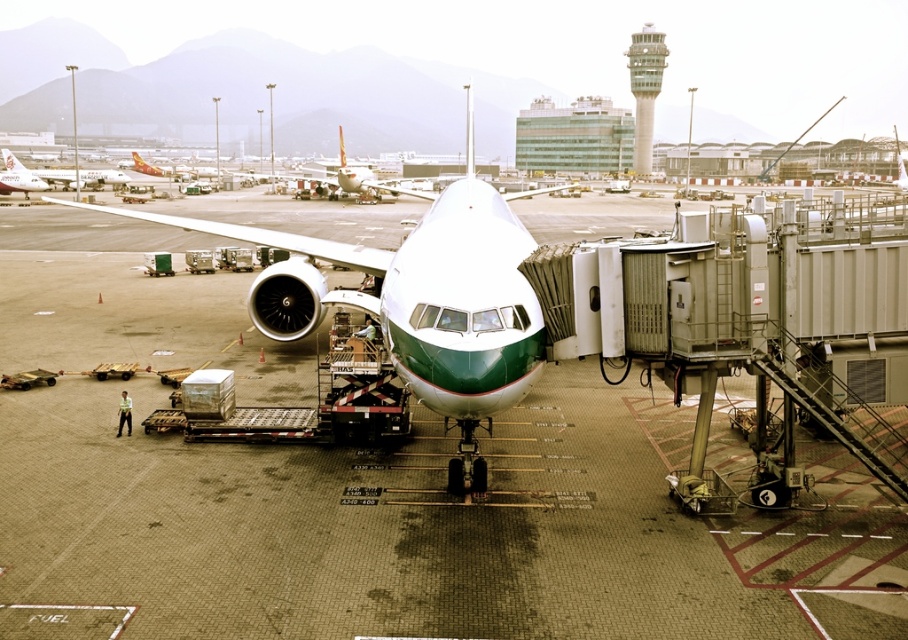
Who is positioned more to the right, green glass control tower at upper center or matte white airplane at left?

Positioned to the right is green glass control tower at upper center.

Measure the distance from green glass control tower at upper center to matte white airplane at left.

They are 68.44 meters apart.

The height and width of the screenshot is (640, 908). Find the location of `green glass control tower at upper center`. green glass control tower at upper center is located at coordinates (645, 90).

Locate an element on the screen. Image resolution: width=908 pixels, height=640 pixels. green glass control tower at upper center is located at coordinates click(x=645, y=90).

Can you confirm if smooth concrete tarmac at center is positioned above matte white airplane at left?

No.

This screenshot has width=908, height=640. Identify the location of smooth concrete tarmac at center. (462, 464).

The image size is (908, 640). I want to click on smooth concrete tarmac at center, so click(x=462, y=464).

Image resolution: width=908 pixels, height=640 pixels. Describe the element at coordinates (462, 464) in the screenshot. I see `smooth concrete tarmac at center` at that location.

Which is behind, point (500, 465) or point (644, 76)?

The point (644, 76) is more distant.

Locate an element on the screen. The width and height of the screenshot is (908, 640). smooth concrete tarmac at center is located at coordinates (462, 464).